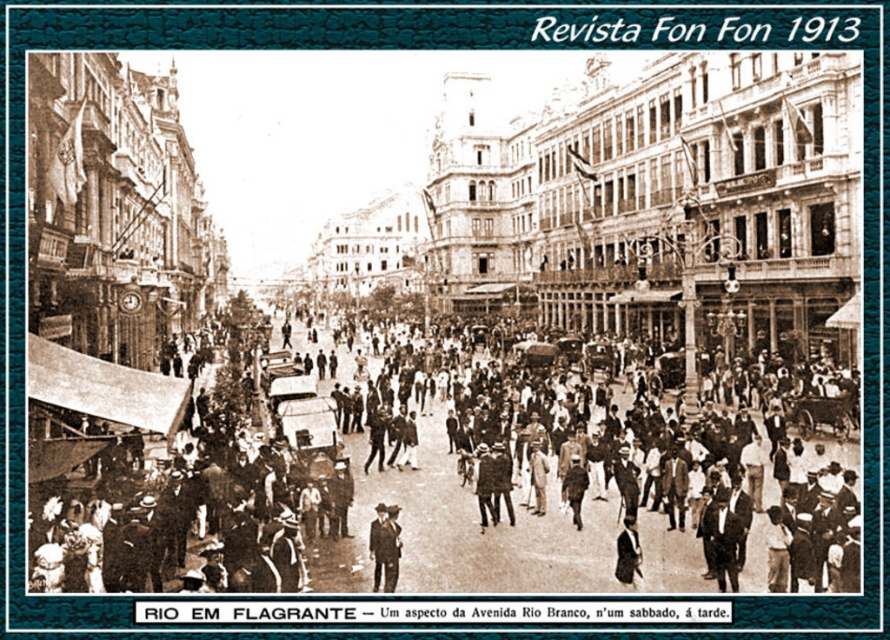
Can you confirm if dark brown suit at center is wider than dark suit at center?

Yes, dark brown suit at center is wider than dark suit at center.

Can you confirm if dark brown suit at center is bigger than dark suit at center?

Correct, dark brown suit at center is larger in size than dark suit at center.

Locate an element on the screen. dark brown suit at center is located at coordinates (462, 486).